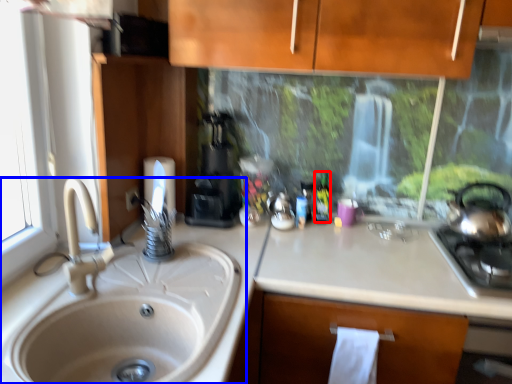
Question: Which object is closer to the camera taking this photo, bottle (highlighted by a red box) or sink (highlighted by a blue box)?

Choices:
 (A) bottle
 (B) sink

Answer: (B)